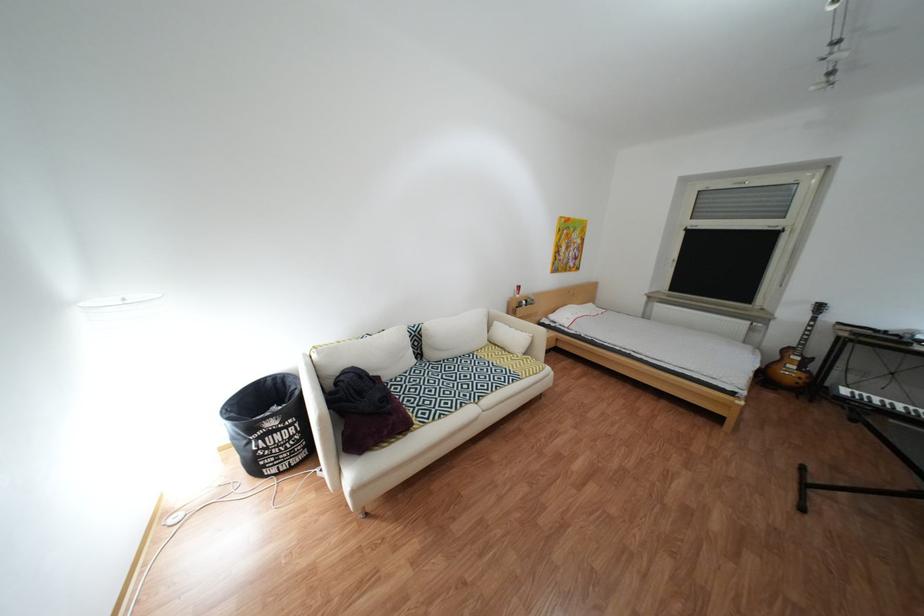
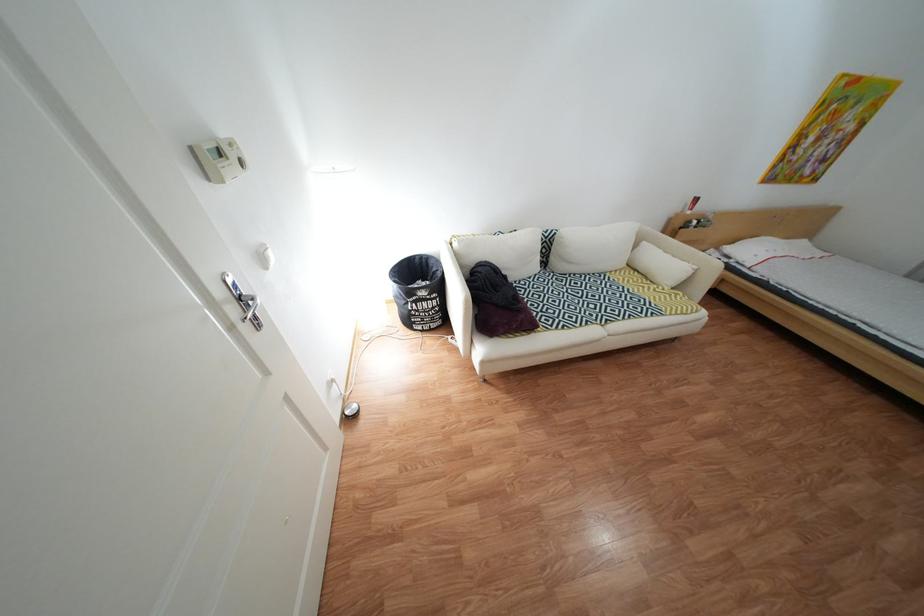
Find the pixel in the second image that matches (x=306, y=422) in the first image.

(450, 296)